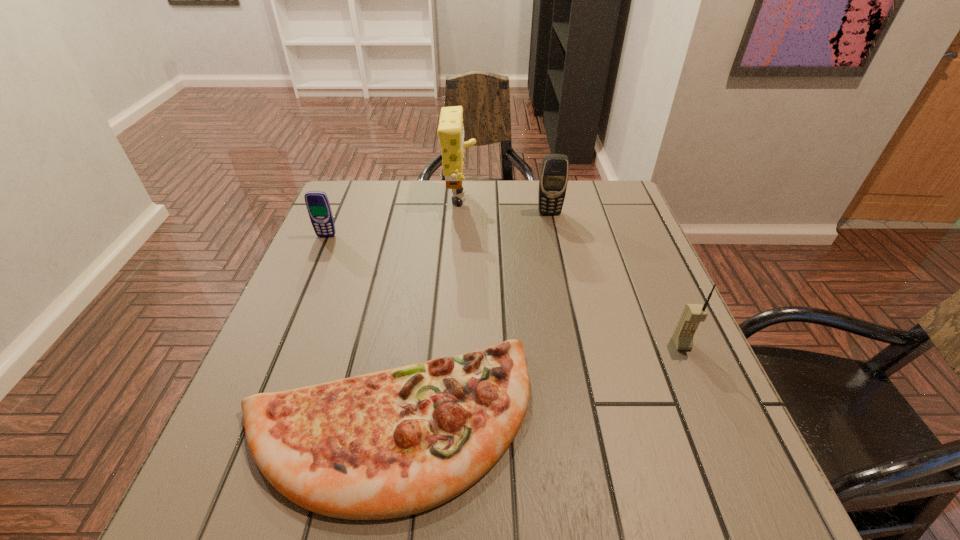
Image resolution: width=960 pixels, height=540 pixels. What are the coordinates of `the tallest object` in the screenshot? It's located at pyautogui.click(x=450, y=131).

You are a GUI agent. You are given a task and a screenshot of the screen. Output one action in this format:
    pyautogui.click(x=<x>, y=<y>)
    Task: Click on the second object from right to left
    This screenshot has width=960, height=540.
    Given the screenshot: What is the action you would take?
    pyautogui.click(x=553, y=179)

This screenshot has width=960, height=540. What are the coordinates of `the farthest cellular telephone` in the screenshot? It's located at (553, 179).

Where is `the second nearest object`? Image resolution: width=960 pixels, height=540 pixels. the second nearest object is located at coordinates (693, 314).

Where is `the nearest cellular telephone`? the nearest cellular telephone is located at coordinates (693, 314).

Locate an element on the screen. The image size is (960, 540). the second nearest cellular telephone is located at coordinates (317, 203).

This screenshot has height=540, width=960. What are the coordinates of `the leftmost cellular telephone` in the screenshot? It's located at (317, 203).

The image size is (960, 540). I want to click on pizza, so click(x=394, y=443).

Identify the location of the nearest object. (394, 443).

This screenshot has width=960, height=540. Identify the location of free spot located on the face of the sponge. (504, 202).